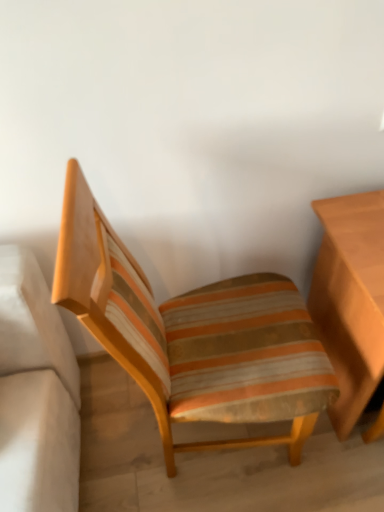
This screenshot has height=512, width=384. What are the coordinates of `striped fabric chair at center` in the screenshot? It's located at (194, 336).

Describe the element at coordinates (194, 336) in the screenshot. I see `striped fabric chair at center` at that location.

What is the approximate width of striped fabric chair at center?

striped fabric chair at center is 23.33 inches wide.

What do you see at coordinates (351, 298) in the screenshot? The height and width of the screenshot is (512, 384). I see `light brown wooden table at right` at bounding box center [351, 298].

Where is `light brown wooden table at right`? This screenshot has height=512, width=384. light brown wooden table at right is located at coordinates (351, 298).

Locate an element on the screen. striped fabric chair at center is located at coordinates (194, 336).

Which object is positioned more to the left, striped fabric chair at center or light brown wooden table at right?

striped fabric chair at center.

Is striped fabric chair at center in front of light brown wooden table at right?

Yes, it is in front of light brown wooden table at right.

Does point (293, 452) come farther from viewer compared to point (375, 292)?

Yes.

From the image's perspective, between striped fabric chair at center and light brown wooden table at right, which one is located above?

light brown wooden table at right appears higher in the image.

From a real-world perspective, which object stands above the other?

striped fabric chair at center, from a real-world perspective.

Is striped fabric chair at center thinner than light brown wooden table at right?

No.

Considering the relative sizes of striped fabric chair at center and light brown wooden table at right in the image provided, is striped fabric chair at center shorter than light brown wooden table at right?

In fact, striped fabric chair at center may be taller than light brown wooden table at right.

Considering the sizes of striped fabric chair at center and light brown wooden table at right in the image, is striped fabric chair at center bigger or smaller than light brown wooden table at right?

Clearly, striped fabric chair at center is larger in size than light brown wooden table at right.

Is striped fabric chair at center outside of light brown wooden table at right?

Yes, striped fabric chair at center is located beyond the bounds of light brown wooden table at right.

Is striped fabric chair at center directly adjacent to light brown wooden table at right?

No, striped fabric chair at center is not beside light brown wooden table at right.

Is striped fabric chair at center positioned with its back to light brown wooden table at right?

striped fabric chair at center does not have its back to light brown wooden table at right.

How many degrees apart are the facing directions of striped fabric chair at center and light brown wooden table at right?

88.4 degrees separate the facing orientations of striped fabric chair at center and light brown wooden table at right.

Identify the location of chair that appears on the left of light brown wooden table at right. This screenshot has height=512, width=384. (194, 336).

Between light brown wooden table at right and striped fabric chair at center, which one appears on the right side from the viewer's perspective?

From the viewer's perspective, light brown wooden table at right appears more on the right side.

Which object is closer to the camera taking this photo, light brown wooden table at right or striped fabric chair at center?

Positioned in front is striped fabric chair at center.

Is point (342, 354) behind point (130, 285)?

Yes, it is behind point (130, 285).

From the image's perspective, is light brown wooden table at right positioned above or below striped fabric chair at center?

light brown wooden table at right is situated higher than striped fabric chair at center in the image.

From a real-world perspective, which is physically below, light brown wooden table at right or striped fabric chair at center?

In real-world perspective, light brown wooden table at right is lower.

Can you confirm if light brown wooden table at right is wider than striped fabric chair at center?

No, light brown wooden table at right is not wider than striped fabric chair at center.

From their relative heights in the image, would you say light brown wooden table at right is taller or shorter than striped fabric chair at center?

Considering their sizes, light brown wooden table at right has less height than striped fabric chair at center.

In terms of size, does light brown wooden table at right appear bigger or smaller than striped fabric chair at center?

Considering their sizes, light brown wooden table at right takes up less space than striped fabric chair at center.

Is light brown wooden table at right inside or outside of striped fabric chair at center?

light brown wooden table at right is not enclosed by striped fabric chair at center.

Is light brown wooden table at right placed right next to striped fabric chair at center?

light brown wooden table at right and striped fabric chair at center are not in contact.

Is light brown wooden table at right oriented away from striped fabric chair at center?

That's not correct — light brown wooden table at right is not looking away from striped fabric chair at center.

Identify the location of table below the striped fabric chair at center (from a real-world perspective). (351, 298).

At what (x,y) coordinates should I click in order to perform the action: click on chair on the left side of light brown wooden table at right. Please return your answer as a coordinate pair (x, y). This screenshot has width=384, height=512. Looking at the image, I should click on (194, 336).

Identify the location of chair in front of the light brown wooden table at right. This screenshot has height=512, width=384. (194, 336).